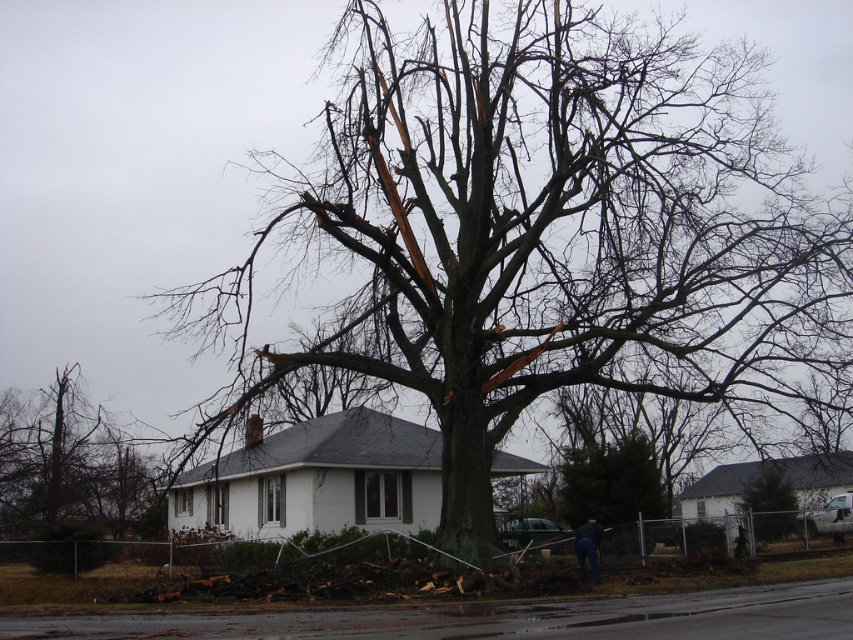
You are a delivery person trying to reach the front door of the house. You are standing near the dark blue jeans at lower center. The green textured tree at center has fallen branches. Can you walk straight towards the house without going around the tree?

The green textured tree at center and dark blue jeans at lower center are 26.92 feet apart from each other. Since the tree is damaged with fallen branches, it might block the direct path. However, the distance is significant, so you might need to go around the tree to reach the house safely.

In the scene shown: You are a city planner assessing the safety of trees in a residential area. You see the brown bark tree at left. Can you determine if the tree is within a safe distance from the house according to the local safety guidelines that require trees to be at least 10 meters away from any structure?

The brown bark tree at left is 23.68 meters from the viewer, which is well beyond the required 10 meters distance from the house. Therefore, it complies with the safety guidelines and is considered safe.

You are standing at the point marked by coordinates point (68,467) and want to walk towards the brown bark tree at left. Which direction should you face to head directly towards it?

You should face directly towards the brown bark tree at left since you are already at its location at point (68,467).